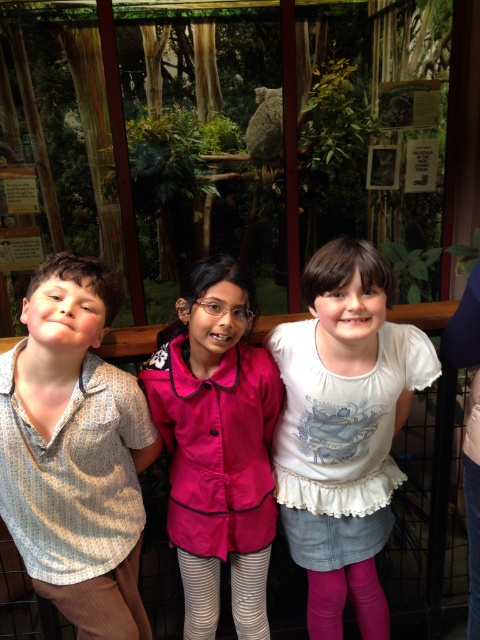
Based on the photo, can you confirm if light brown textured shirt at left is wider than white cotton shirt at center?

No, light brown textured shirt at left is not wider than white cotton shirt at center.

Which is behind, point (98, 492) or point (334, 536)?

Positioned behind is point (334, 536).

Is point (111, 420) less distant than point (300, 371)?

Yes, point (111, 420) is in front of point (300, 371).

I want to click on light brown textured shirt at left, so click(x=74, y=451).

Between white cotton shirt at center and pink fabric shirt at center, which one has less height?

Standing shorter between the two is pink fabric shirt at center.

Is point (365, 502) closer to camera compared to point (165, 440)?

No, it is not.

The height and width of the screenshot is (640, 480). Identify the location of white cotton shirt at center. (344, 429).

Is light brown textured shirt at left taller than pink fabric shirt at center?

No, light brown textured shirt at left is not taller than pink fabric shirt at center.

What are the coordinates of `light brown textured shirt at left` in the screenshot? It's located at (74, 451).